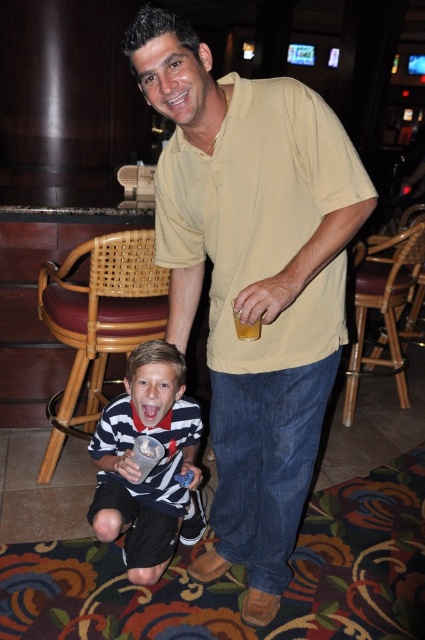
You are a photographer setting up for a group photo. You notice the yellow cotton shirt at center and the translucent plastic cup at center in the scene. Which object should you avoid placing near the edge of the frame to prevent it from being cut off?

You should avoid placing the translucent plastic cup at center near the edge of the frame because it is smaller than the yellow cotton shirt at center and more likely to be accidentally cut off if positioned too close to the frame edge.

You are a photographer trying to capture a photo of the yellow cotton shirt at center. According to the coordinates provided, where should you position your camera to ensure the shirt is in the frame?

The yellow cotton shirt at center is located at point (x=252, y=280), so you should position your camera to focus on that coordinate to capture it in the frame.

You are a photographer trying to capture a group photo of two people wearing the yellow cotton shirt at center and the striped cotton shirt at lower left. Since you want to frame them properly, which shirt should be placed to the left in the photo?

The striped cotton shirt at lower left should be placed to the left in the photo because the yellow cotton shirt at center is positioned on the right side of striped cotton shirt at lower left.